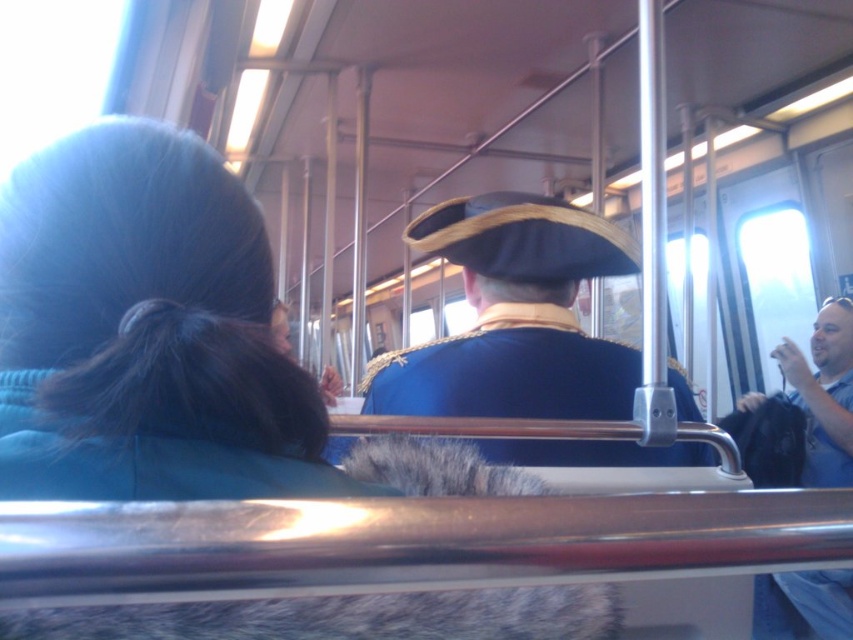
You are a tailor who needs to determine which garment requires more fabric for alterations. Based on the image, which of the two items, the blue velvet coat at center or the blue cotton shirt at right, would need more fabric due to its size?

The blue velvet coat at center requires more fabric because its width is larger than the blue cotton shirt at right.

You are a passenger on the train and want to ask the person in the blue velvet coat at center a question. To do so, you need to walk around the blue cotton shirt at right. Is this possible given their positions?

The blue velvet coat at center is in front of the blue cotton shirt at right, so you would need to go around the blue cotton shirt at right to reach the blue velvet coat at center.